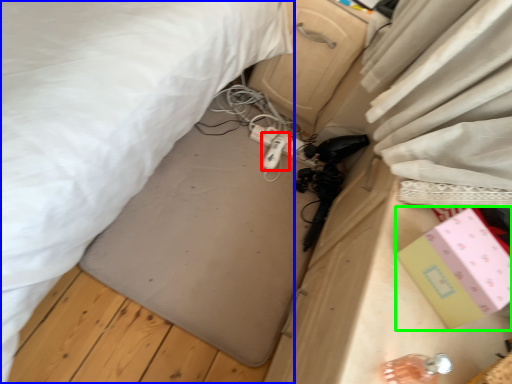
Question: Based on their relative distances, which object is farther from equipment (highlighted by a red box)? Choose from bed (highlighted by a blue box) and box (highlighted by a green box).

Choices:
 (A) bed
 (B) box

Answer: (B)